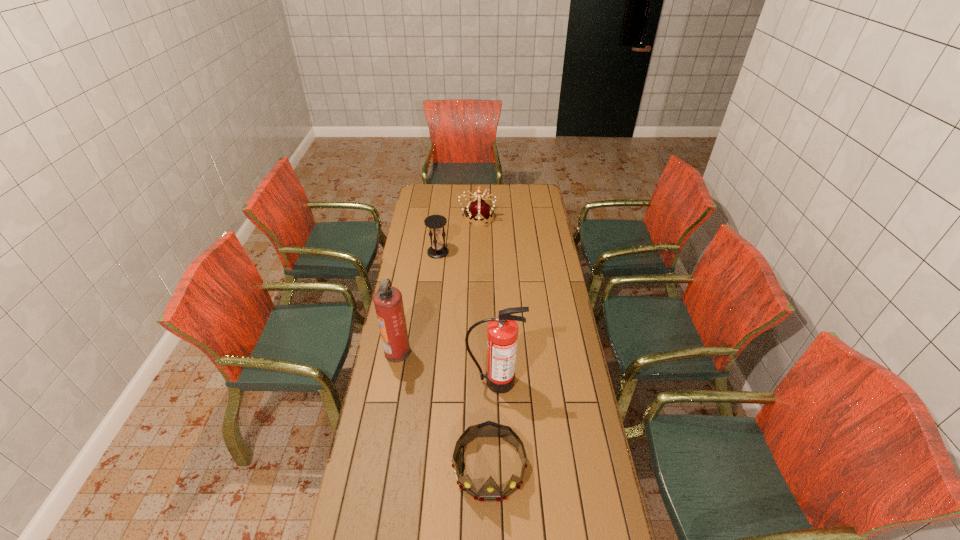
You are a GUI agent. You are given a task and a screenshot of the screen. Output one action in this format:
    pyautogui.click(x=<x>, y=<y>)
    Task: Click on the vacant position located at the nozzle of the left fire extinguisher
    
    Given the screenshot: What is the action you would take?
    pyautogui.click(x=488, y=352)

This screenshot has width=960, height=540. Find the location of `free space located 0.340m on the front-facing side of the fourth farthest object`. free space located 0.340m on the front-facing side of the fourth farthest object is located at coordinates (497, 487).

You are a GUI agent. You are given a task and a screenshot of the screen. Output one action in this format:
    pyautogui.click(x=<x>, y=<y>)
    Task: Click on the free location located on the front-facing side of the farthest object
    The height and width of the screenshot is (540, 960).
    Given the screenshot: What is the action you would take?
    pyautogui.click(x=533, y=218)

At what (x,y) coordinates should I click in order to perform the action: click on vacant space situated on the front of the hourglass. Please return your answer as a coordinate pair (x, y). The image size is (960, 540). Looking at the image, I should click on (432, 300).

You are a GUI agent. You are given a task and a screenshot of the screen. Output one action in this format:
    pyautogui.click(x=<x>, y=<y>)
    Task: Click on the fire extinguisher located in the left edge section of the desktop
    This screenshot has height=540, width=960.
    Given the screenshot: What is the action you would take?
    pyautogui.click(x=388, y=302)

The width and height of the screenshot is (960, 540). Identify the location of hourglass that is positioned at the left edge. (437, 250).

Find the location of a particular element. Image resolution: width=960 pixels, height=540 pixels. vacant space at the far edge of the desktop is located at coordinates (465, 193).

Find the location of `blank space at the left edge of the desktop`. blank space at the left edge of the desktop is located at coordinates (412, 208).

The image size is (960, 540). I want to click on free space at the right edge, so click(559, 410).

Find the location of a particular element. The height and width of the screenshot is (540, 960). free space at the far left corner is located at coordinates (419, 187).